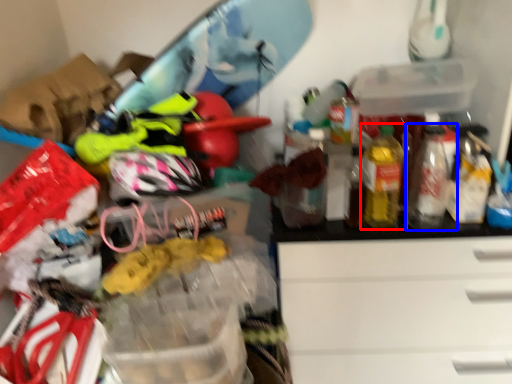
Question: Which object is closer to the camera taking this photo, bottle (highlighted by a red box) or bottle (highlighted by a blue box)?

Choices:
 (A) bottle
 (B) bottle

Answer: (A)